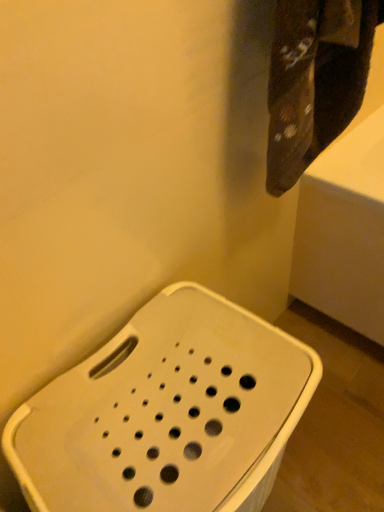
The width and height of the screenshot is (384, 512). In order to click on white plastic stool at lower left in this screenshot , I will do `click(166, 413)`.

Measure the distance between point (x=220, y=506) and camera.

The distance of point (x=220, y=506) from camera is 21.65 inches.

Image resolution: width=384 pixels, height=512 pixels. What do you see at coordinates (166, 413) in the screenshot?
I see `white plastic stool at lower left` at bounding box center [166, 413].

I want to click on dark brown fabric at upper right, so click(x=315, y=80).

What do you see at coordinates (315, 80) in the screenshot?
I see `dark brown fabric at upper right` at bounding box center [315, 80].

This screenshot has height=512, width=384. Find the location of `white plastic stool at lower left`. white plastic stool at lower left is located at coordinates (166, 413).

Which is more to the right, dark brown fabric at upper right or white plastic stool at lower left?

Positioned to the right is dark brown fabric at upper right.

Looking at this image, who is more distant, dark brown fabric at upper right or white plastic stool at lower left?

dark brown fabric at upper right is further from the camera.

Which is closer to the camera, (317,145) or (101,472)?

Point (101,472)

In the scene shown: From the image's perspective, would you say dark brown fabric at upper right is shown under white plastic stool at lower left?

No, from the image's perspective, dark brown fabric at upper right is not below white plastic stool at lower left.

From a real-world perspective, which is physically below, dark brown fabric at upper right or white plastic stool at lower left?

white plastic stool at lower left is physically lower.

In the scene shown: Is dark brown fabric at upper right wider than white plastic stool at lower left?

No, dark brown fabric at upper right is not wider than white plastic stool at lower left.

Considering the sizes of objects dark brown fabric at upper right and white plastic stool at lower left in the image provided, who is taller, dark brown fabric at upper right or white plastic stool at lower left?

With more height is white plastic stool at lower left.

Can you confirm if dark brown fabric at upper right is bigger than white plastic stool at lower left?

No.

Is dark brown fabric at upper right inside the boundaries of white plastic stool at lower left, or outside?

The correct answer is: outside.

Are dark brown fabric at upper right and white plastic stool at lower left beside each other?

No, dark brown fabric at upper right is not in contact with white plastic stool at lower left.

Is dark brown fabric at upper right facing towards white plastic stool at lower left?

No, dark brown fabric at upper right is not aimed at white plastic stool at lower left.

What's the angular difference between dark brown fabric at upper right and white plastic stool at lower left's facing directions?

The angular difference between dark brown fabric at upper right and white plastic stool at lower left is 0.95 degrees.

Measure the distance from dark brown fabric at upper right to white plastic stool at lower left.

16.09 inches.

Locate an element on the screen. porcelain in front of the dark brown fabric at upper right is located at coordinates (166, 413).

Considering the relative positions of white plastic stool at lower left and dark brown fabric at upper right in the image provided, is white plastic stool at lower left to the left of dark brown fabric at upper right from the viewer's perspective?

Yes, white plastic stool at lower left is to the left of dark brown fabric at upper right.

Does white plastic stool at lower left come behind dark brown fabric at upper right?

No, it is in front of dark brown fabric at upper right.

Which point is more distant from viewer, (230, 464) or (327, 102)?

Point (327, 102)

From the image's perspective, is white plastic stool at lower left located beneath dark brown fabric at upper right?

Indeed, from the image's perspective, white plastic stool at lower left is shown beneath dark brown fabric at upper right.

From a real-world perspective, relative to dark brown fabric at upper right, is white plastic stool at lower left vertically above or below?

white plastic stool at lower left is situated lower than dark brown fabric at upper right in the real world.

Looking at their sizes, would you say white plastic stool at lower left is wider or thinner than dark brown fabric at upper right?

Considering their sizes, white plastic stool at lower left looks broader than dark brown fabric at upper right.

Which of these two, white plastic stool at lower left or dark brown fabric at upper right, stands shorter?

With less height is dark brown fabric at upper right.

Does white plastic stool at lower left have a smaller size compared to dark brown fabric at upper right?

Actually, white plastic stool at lower left might be larger than dark brown fabric at upper right.

Is white plastic stool at lower left not inside dark brown fabric at upper right?

white plastic stool at lower left is positioned outside dark brown fabric at upper right.

Can you see white plastic stool at lower left touching dark brown fabric at upper right?

They are not placed beside each other.

Is white plastic stool at lower left looking in the opposite direction of dark brown fabric at upper right?

No, white plastic stool at lower left is not facing away from dark brown fabric at upper right.

How many degrees apart are the facing directions of white plastic stool at lower left and dark brown fabric at upper right?

The facing directions of white plastic stool at lower left and dark brown fabric at upper right are 0.95 degrees apart.

How much distance is there between white plastic stool at lower left and dark brown fabric at upper right?

The distance of white plastic stool at lower left from dark brown fabric at upper right is 16.09 inches.

In the image, there is a white plastic stool at lower left. At what (x,y) coordinates should I click in order to perform the action: click on towel above it (from the image's perspective). Please return your answer as a coordinate pair (x, y). Looking at the image, I should click on (315, 80).

This screenshot has width=384, height=512. What are the coordinates of `porcelain directly beneath the dark brown fabric at upper right (from a real-world perspective)` in the screenshot? It's located at (166, 413).

The image size is (384, 512). Find the location of `towel that is behind the white plastic stool at lower left`. towel that is behind the white plastic stool at lower left is located at coordinates (315, 80).